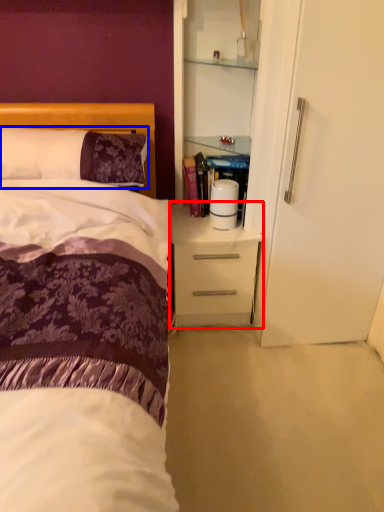
Question: Among these objects, which one is nearest to the camera, desk (highlighted by a red box) or pillow (highlighted by a blue box)?

Choices:
 (A) desk
 (B) pillow

Answer: (B)